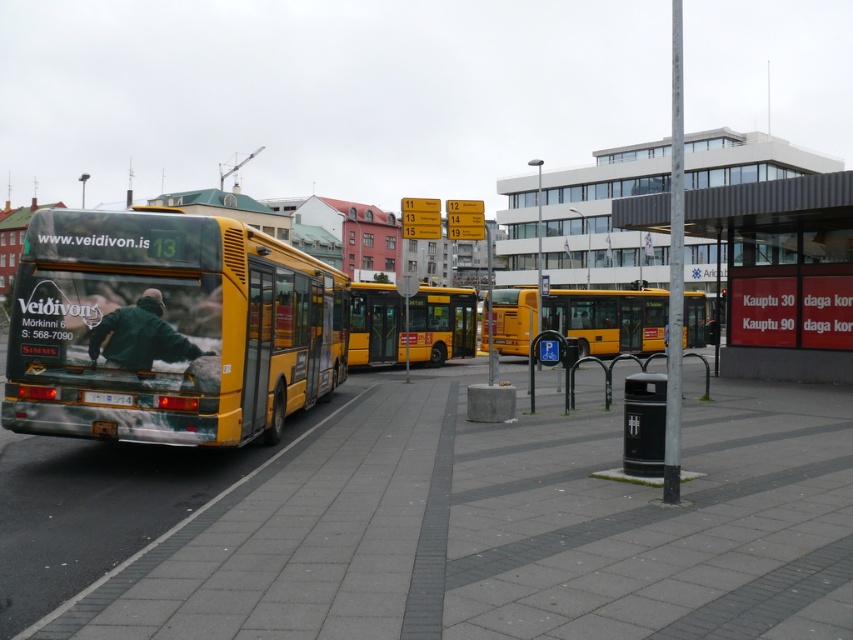
Is yellow metallic bus stop at center taller than yellow metallic bus at center?

Correct, yellow metallic bus stop at center is much taller as yellow metallic bus at center.

Is yellow metallic bus stop at center positioned behind yellow metallic bus at center?

No, it is in front of yellow metallic bus at center.

The height and width of the screenshot is (640, 853). Describe the element at coordinates (782, 275) in the screenshot. I see `yellow metallic bus stop at center` at that location.

Where is `yellow metallic bus stop at center`? yellow metallic bus stop at center is located at coordinates (782, 275).

Who is higher up, yellow metallic bus at center or yellow matte bus at center?

yellow metallic bus at center

Between yellow metallic bus at center and yellow matte bus at center, which one has less height?

With less height is yellow matte bus at center.

Between point (622, 291) and point (369, 323), which one is positioned behind?

The point (622, 291) is more distant.

This screenshot has width=853, height=640. Find the location of `yellow metallic bus at center`. yellow metallic bus at center is located at coordinates (608, 320).

Who is more forward, (x=44, y=246) or (x=750, y=272)?

Positioned in front is point (x=44, y=246).

Is yellow matte bus at left bigger than yellow metallic bus stop at center?

Result: Actually, yellow matte bus at left might be smaller than yellow metallic bus stop at center.

Is point (244, 362) closer to viewer compared to point (775, 362)?

That is True.

You are a GUI agent. You are given a task and a screenshot of the screen. Output one action in this format:
    pyautogui.click(x=<x>, y=<y>)
    Task: Click on the yellow matte bus at left
    The width and height of the screenshot is (853, 640).
    Given the screenshot: What is the action you would take?
    pyautogui.click(x=167, y=330)